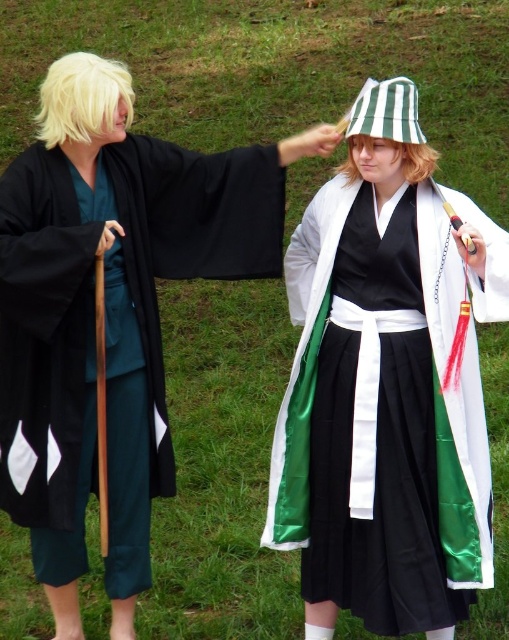
Identify the location of black satin robe at left. (108, 314).

Which is more to the right, black satin robe at left or green striped fabric bucket hat at upper center?

green striped fabric bucket hat at upper center is more to the right.

What do you see at coordinates (108, 314) in the screenshot? I see `black satin robe at left` at bounding box center [108, 314].

The image size is (509, 640). I want to click on black satin robe at left, so click(108, 314).

Which is above, green satin kimono at center or green striped fabric bucket hat at upper center?

green striped fabric bucket hat at upper center is above.

Is point (359, 520) more distant than point (358, 108)?

Yes, it is behind point (358, 108).

The height and width of the screenshot is (640, 509). Identify the location of green satin kimono at center. (386, 396).

Is green satin kimono at center further to camera compared to black satin robe at left?

No, it is in front of black satin robe at left.

Is green satin kimono at center closer to camera compared to black satin robe at left?

Yes, green satin kimono at center is in front of black satin robe at left.

What are the coordinates of `green satin kimono at center` in the screenshot? It's located at (386, 396).

Where is `green satin kimono at center`? The height and width of the screenshot is (640, 509). green satin kimono at center is located at coordinates (386, 396).